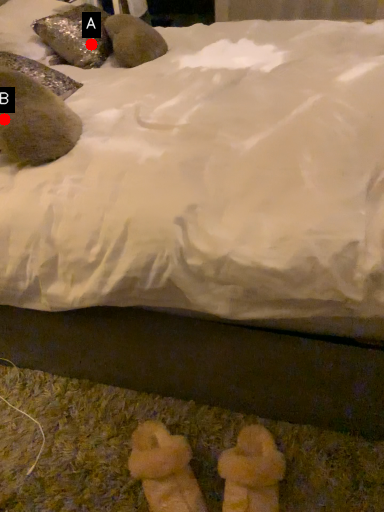
Question: Two points are circled on the image, labeled by A and B beside each circle. Which point is closer to the camera?

Choices:
 (A) A is closer
 (B) B is closer

Answer: (B)